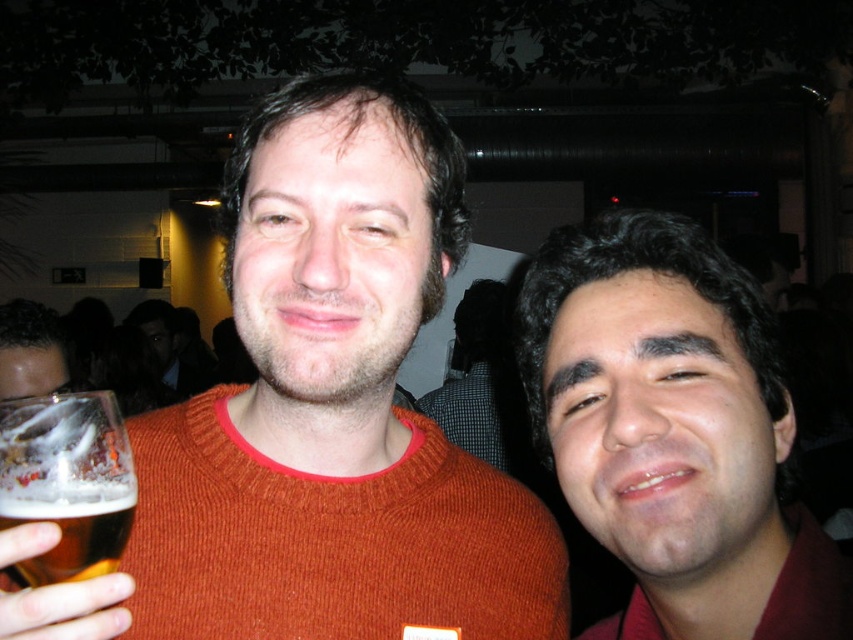
You are at a party and need to decide whether to place a new drink on the table between the matte red shirt at right and the translucent glass at left. The table has just enough space for either the shirt or the glass. Which one should you move to make room?

The matte red shirt at right is wider than the translucent glass at left, so you should move the matte red shirt at right to make room for the new drink.

You are standing in a bar and see two people posing for a photo. The person on the left is wearing a reddish orange sweater with a red collar. The person on the right has curly dark hair and a maroon shirt. There is a point at coordinates (323, 413) in the image. Where is the orange knitted sweater located in relation to this point?

The point at (323, 413) indicates the location of the orange knitted sweater at center, so the orange knitted sweater is exactly at that coordinate.

You are a photographer trying to adjust the lighting for a photo of the two people. The matte red shirt at right is represented by point (672, 432). Where should you place the spotlight to ensure it illuminates the matte red shirt at right without affecting the other person?

The spotlight should be placed near point (672, 432) to illuminate the matte red shirt at right without affecting the other person.